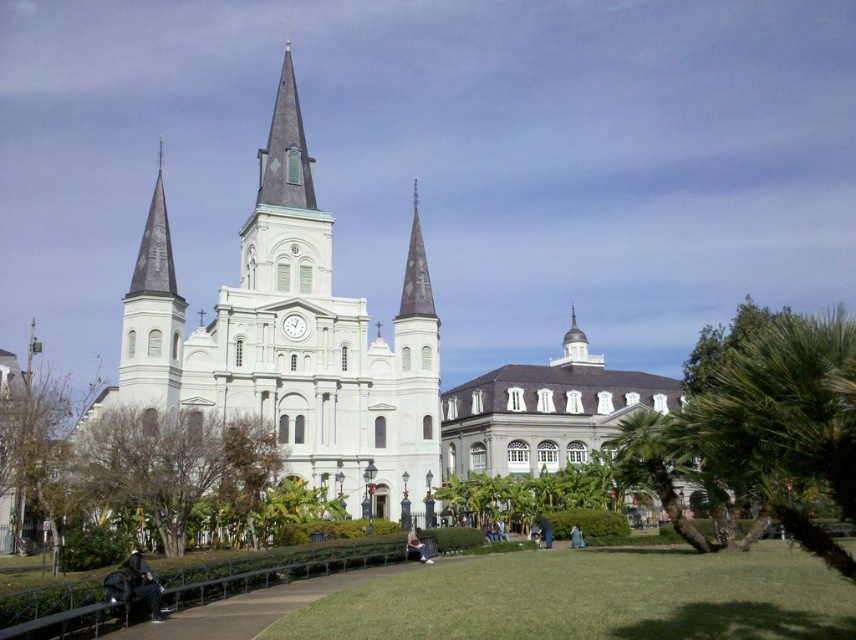
Does green grass at center appear on the left side of blue jeans at lower right?

In fact, green grass at center is to the right of blue jeans at lower right.

Who is shorter, green grass at center or blue jeans at lower right?

blue jeans at lower right is shorter.

This screenshot has height=640, width=856. What do you see at coordinates (591, 598) in the screenshot?
I see `green grass at center` at bounding box center [591, 598].

Find the location of a particular element. The height and width of the screenshot is (640, 856). green grass at center is located at coordinates (591, 598).

Between white stone church at center and light brown leather jacket at lower center, which one is positioned lower?

Positioned lower is light brown leather jacket at lower center.

Where is `white stone church at center`? white stone church at center is located at coordinates (292, 339).

Is point (378, 369) positioned after point (421, 557)?

Yes, point (378, 369) is behind point (421, 557).

I want to click on white stone church at center, so click(x=292, y=339).

Who is positioned more to the right, white stone church at center or green grass at center?

From the viewer's perspective, green grass at center appears more on the right side.

Is point (354, 326) behind point (461, 582)?

That is True.

Where is `white stone church at center`? white stone church at center is located at coordinates (292, 339).